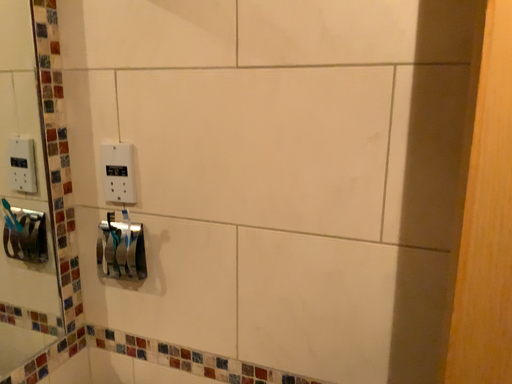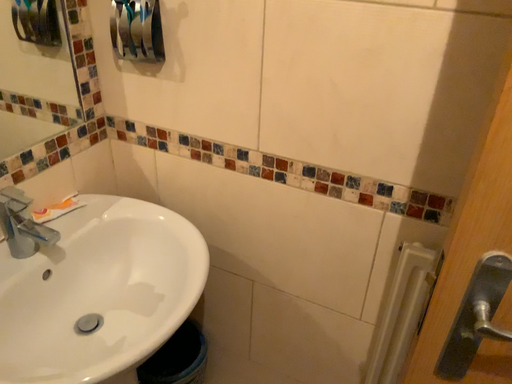
Question: How did the camera likely rotate when shooting the video?

Choices:
 (A) rotated downward
 (B) rotated upward

Answer: (A)